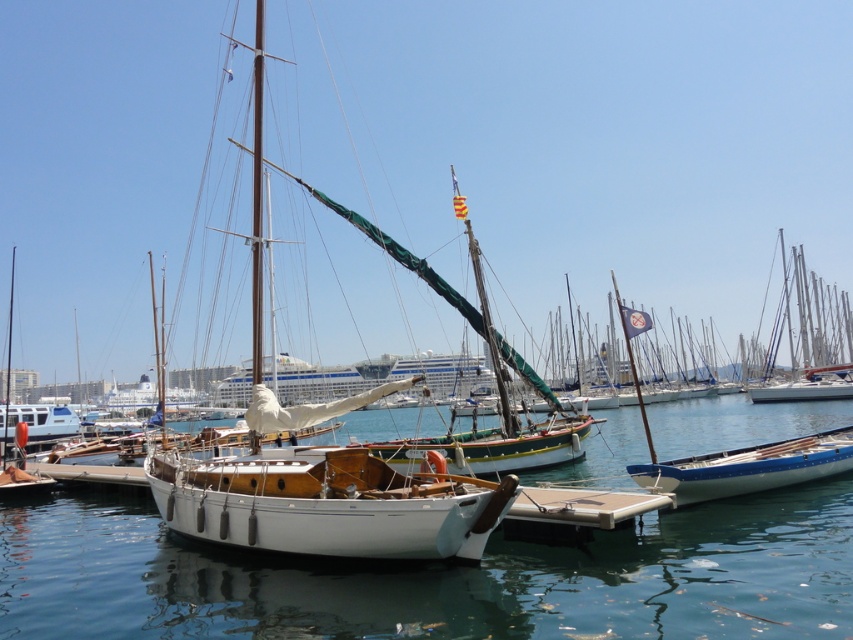
Question: Which of the following is the farthest from the observer?

Choices:
 (A) (445, 552)
 (B) (79, 618)

Answer: (A)

Question: Is clear blue water at center to the right of white glossy boat at lower right from the viewer's perspective?

Choices:
 (A) no
 (B) yes

Answer: (B)

Question: Which point appears farthest from the camera in this image?

Choices:
 (A) (62, 410)
 (B) (656, 481)
 (C) (670, 422)
 (D) (329, 474)

Answer: (A)

Question: Does clear blue water at center come behind white wood sailboat at center?

Choices:
 (A) no
 (B) yes

Answer: (A)

Question: Does clear blue water at center have a lesser width compared to white wood sailboat at center?

Choices:
 (A) yes
 (B) no

Answer: (B)

Question: Considering the real-world distances, which object is farthest from the clear blue water at center?

Choices:
 (A) white wood sailboat at center
 (B) white plastic boat at lower left

Answer: (B)